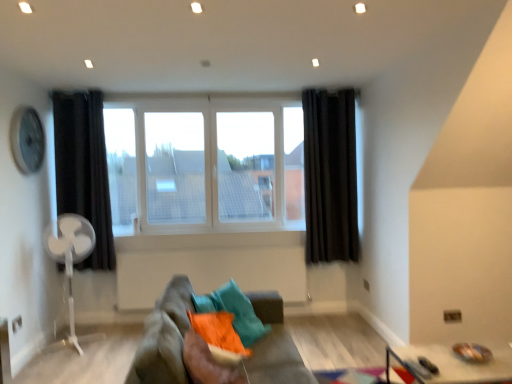
This screenshot has width=512, height=384. I want to click on vacant space situated above black fabric curtain at left, acting as the first curtain starting from the left (from a real-world perspective), so click(x=80, y=87).